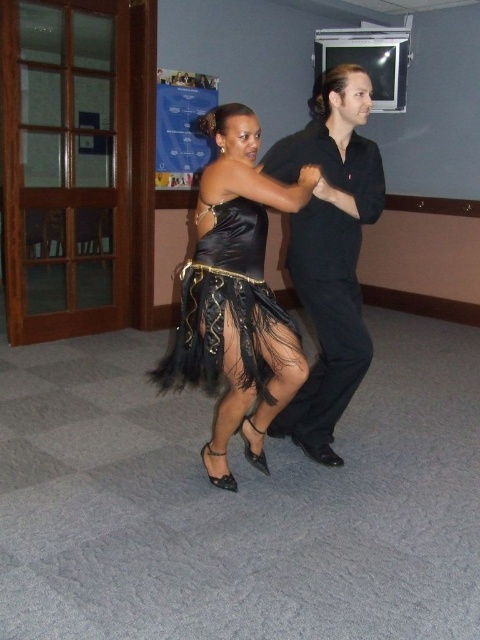
You are a photographer positioned at the back of the dance studio. You need to capture a photo of both the satin black dress at center and the black satin shirt at center in the same frame. Which direction should you move to ensure both are visible in your shot?

You should move to the right to ensure both the satin black dress at center and the black satin shirt at center are visible in your shot because the dress is to the left of the shirt.

You are a photographer standing at the back of the studio. You want to capture both the satin black dress at center and the satin dress at center in a single shot. Which dress should you focus on first to ensure both are in frame?

The satin black dress at center is much taller than the satin dress at center, so focusing on the taller one first will ensure both are in frame.

You are a photographer at a dance event. You need to capture a photo of the satin black dress at center and the black satin shirt at center. Which one will have more fabric visible below the waist?

The satin black dress at center is shorter than the black satin shirt at center, so the black satin shirt at center will have more fabric visible below the waist.